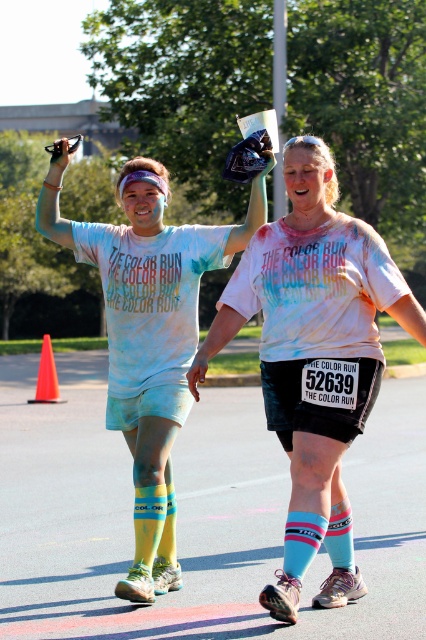
Question: Which object appears farthest from the camera in this image?

Choices:
 (A) orange plastic cone at lower left
 (B) matte white t-shirt at center

Answer: (A)

Question: Does matte white t-shirt at center have a lesser width compared to orange plastic cone at lower left?

Choices:
 (A) yes
 (B) no

Answer: (B)

Question: Which point appears farthest from the camera in this image?

Choices:
 (A) (45, 401)
 (B) (362, 257)

Answer: (A)

Question: Which point appears closest to the camera in this image?

Choices:
 (A) (40, 374)
 (B) (353, 589)

Answer: (B)

Question: Can you confirm if matte white t-shirt at center is positioned above orange plastic cone at lower left?

Choices:
 (A) no
 (B) yes

Answer: (B)

Question: Does matte white t-shirt at center have a larger size compared to orange plastic cone at lower left?

Choices:
 (A) yes
 (B) no

Answer: (A)